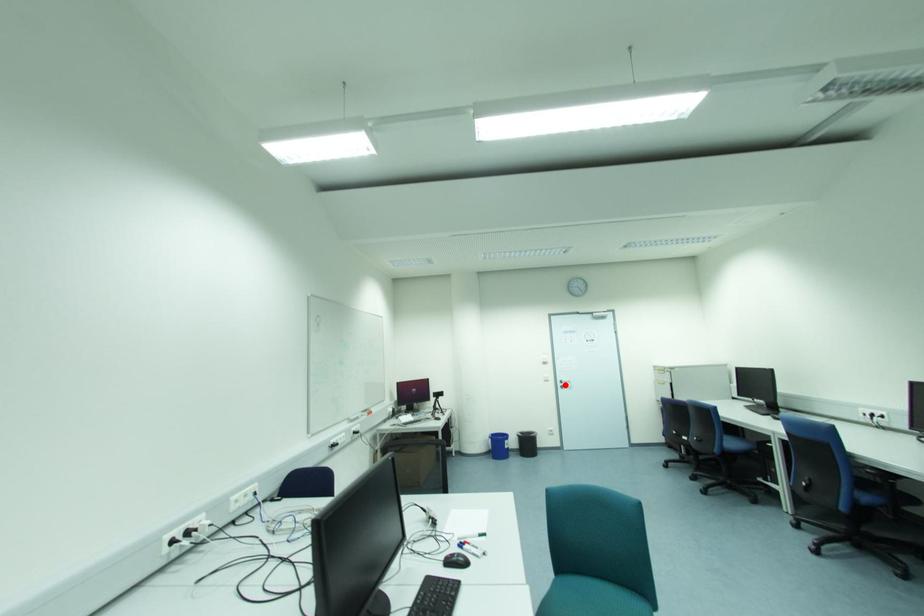
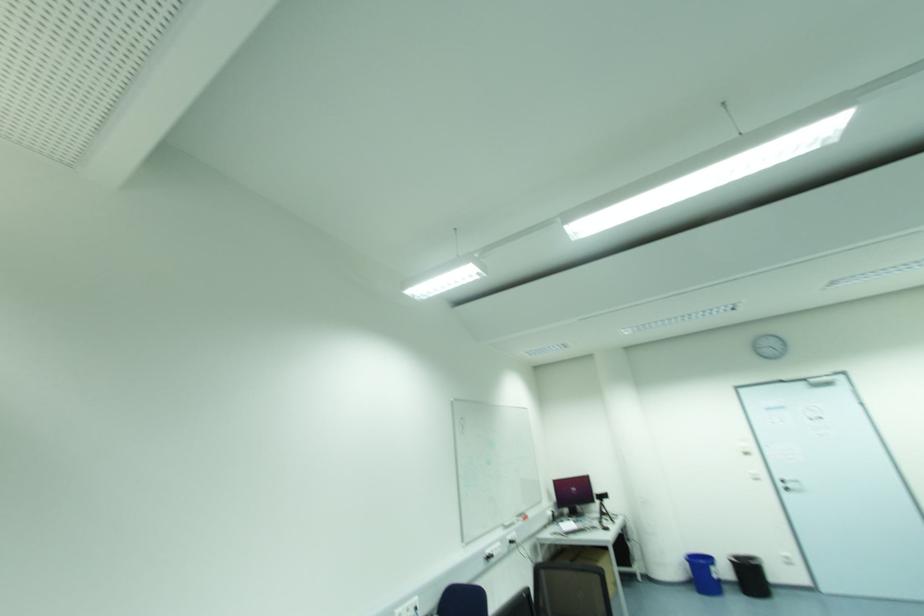
Question: I am providing you with two images of the same scene from different viewpoints. Given a red point in image1, look at the same physical point in image2. Is it:

Choices:
 (A) Closer to the viewpoint
 (B) Farther from the viewpoint

Answer: (A)